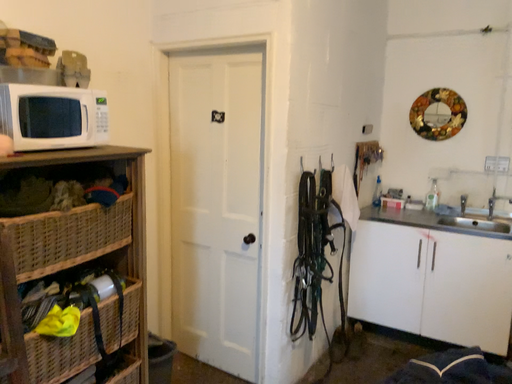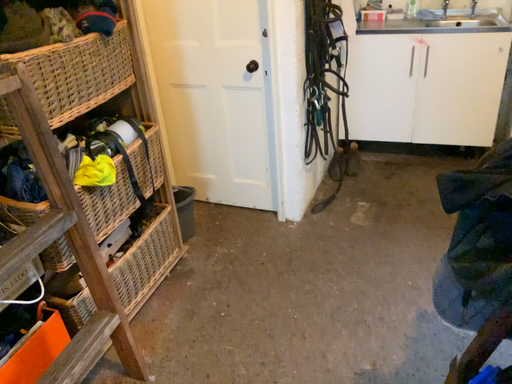
Question: How did the camera likely rotate when shooting the video?

Choices:
 (A) rotated downward
 (B) rotated upward

Answer: (A)